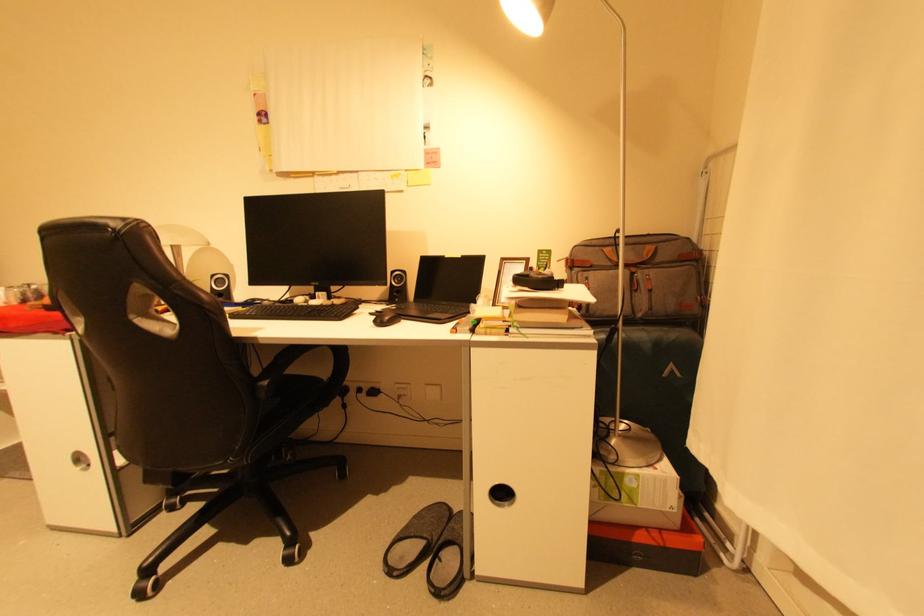
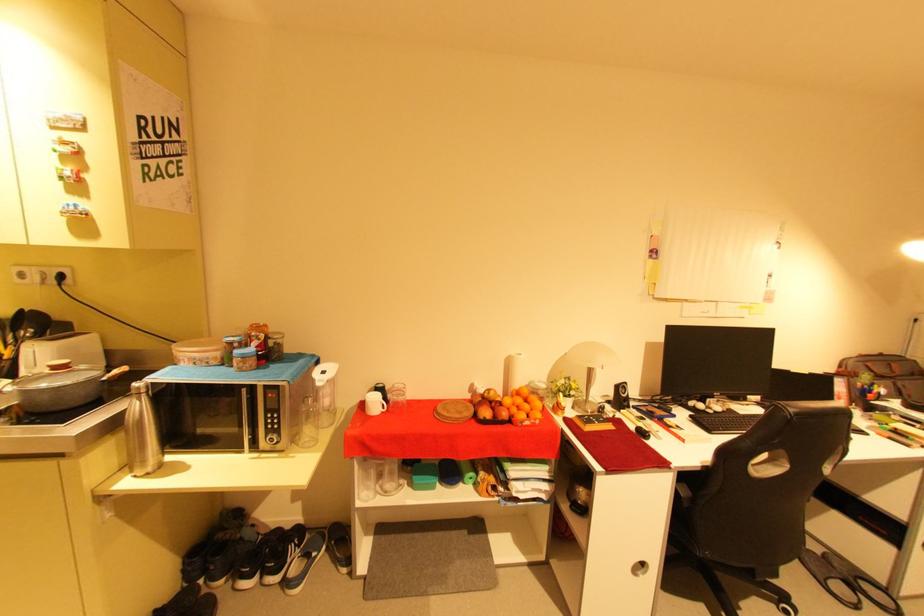
Question: The images are taken continuously from a first-person perspective. In which direction are you moving?

Choices:
 (A) Left
 (B) Right
 (C) Forward
 (D) Backward

Answer: (A)